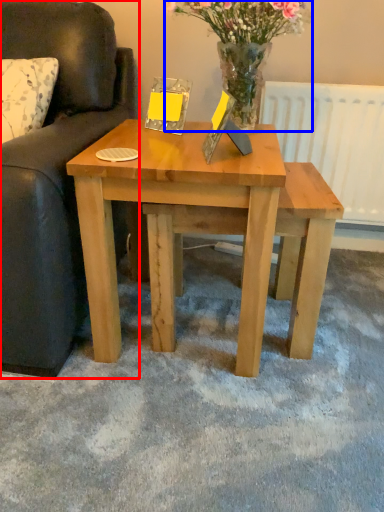
Question: Which point is closer to the camera, studio couch (highlighted by a red box) or floral arrangement (highlighted by a blue box)?

Choices:
 (A) studio couch
 (B) floral arrangement

Answer: (A)